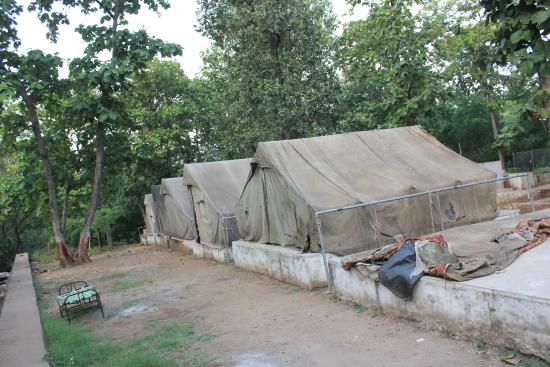
Locate an element on the screen. Image resolution: width=550 pixels, height=367 pixels. wall is located at coordinates (27, 303).